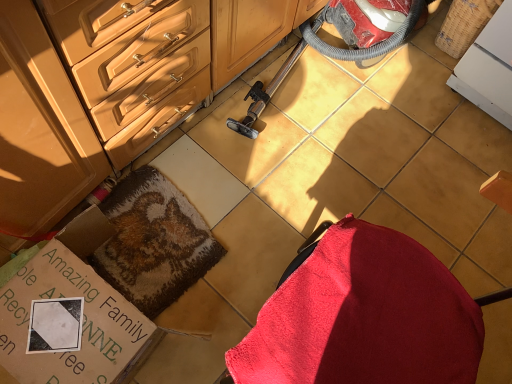
The height and width of the screenshot is (384, 512). I want to click on free space behind velvet red swivel chair at center, so click(x=345, y=201).